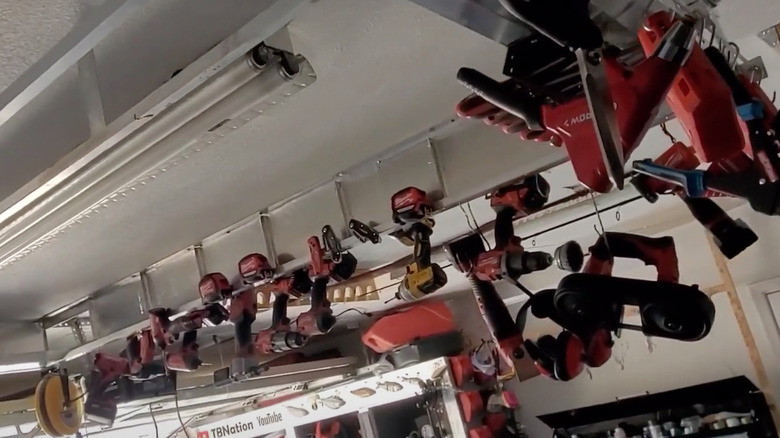
Find the location of a particular element. The width and height of the screenshot is (780, 438). ceiling is located at coordinates (45, 33).